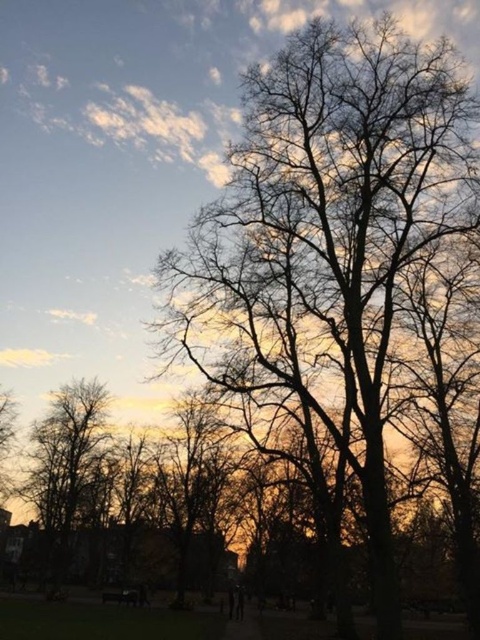
The image size is (480, 640). Describe the element at coordinates (330, 236) in the screenshot. I see `silhouette leafless tree at center` at that location.

The width and height of the screenshot is (480, 640). What do you see at coordinates (330, 236) in the screenshot? I see `silhouette leafless tree at center` at bounding box center [330, 236].

Find the location of `silhouette leafless tree at center`. silhouette leafless tree at center is located at coordinates (330, 236).

Between point (367, 148) and point (45, 477), which one is positioned behind?

The point (45, 477) is more distant.

Between point (313, 90) and point (62, 541), which one is positioned behind?

The point (62, 541) is behind.

The width and height of the screenshot is (480, 640). Find the location of `silhouette leafless tree at center`. silhouette leafless tree at center is located at coordinates (330, 236).

Who is taller, silhouette bare tree at left or wooden park bench at lower center?

silhouette bare tree at left is taller.

Can you confirm if silhouette bare tree at left is taller than wooden park bench at lower center?

Yes, silhouette bare tree at left is taller than wooden park bench at lower center.

Does point (80, 390) come in front of point (103, 600)?

No, it is not.

The image size is (480, 640). What are the coordinates of `silhouette bare tree at left` in the screenshot? It's located at (68, 467).